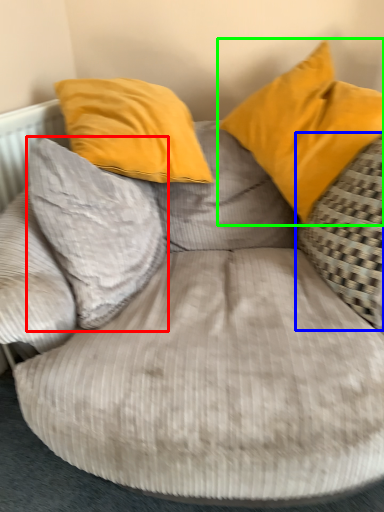
Question: Considering the real-world distances, which object is closest to pillow (highlighted by a red box)? pillow (highlighted by a blue box) or pillow (highlighted by a green box).

Choices:
 (A) pillow
 (B) pillow

Answer: (B)